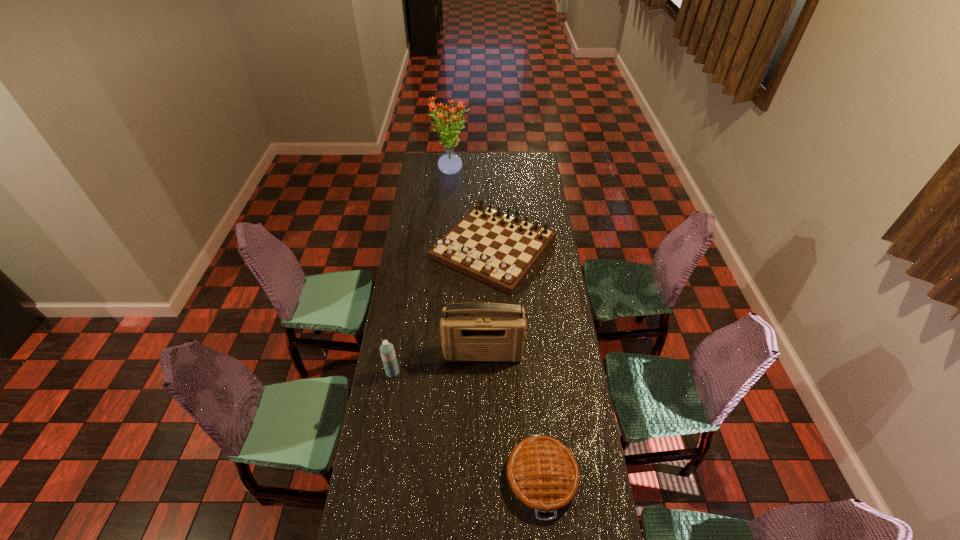
Where is `free space located 0.350m on the front-facing side of the third nearest object`? free space located 0.350m on the front-facing side of the third nearest object is located at coordinates (484, 451).

The image size is (960, 540). Find the location of `vacant space situated 0.370m on the back of the leftmost object`. vacant space situated 0.370m on the back of the leftmost object is located at coordinates (405, 296).

The width and height of the screenshot is (960, 540). Find the location of `free space located on the left of the chessboard`. free space located on the left of the chessboard is located at coordinates (408, 247).

This screenshot has width=960, height=540. I want to click on free location located on the back of the pie, so click(x=533, y=382).

Where is `object at the far edge`? This screenshot has height=540, width=960. object at the far edge is located at coordinates (449, 163).

In order to click on flower arrangement at the left edge in this screenshot , I will do `click(449, 163)`.

Locate an element on the screen. This screenshot has height=540, width=960. water bottle at the left edge is located at coordinates (387, 351).

The height and width of the screenshot is (540, 960). Identify the location of chessboard that is at the left edge. [499, 249].

What are the coordinates of `chessboard present at the right edge` in the screenshot? It's located at (499, 249).

Image resolution: width=960 pixels, height=540 pixels. I want to click on pie that is positioned at the right edge, so click(x=542, y=472).